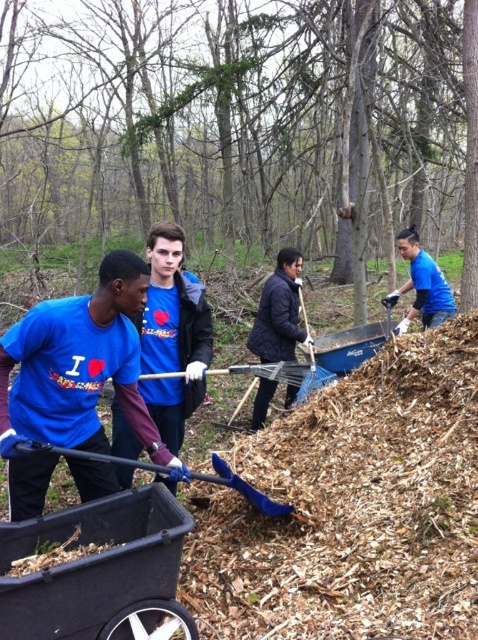
Which of these two, black plastic cart at lower left or blue plastic shovel at lower center, stands shorter?

blue plastic shovel at lower center is shorter.

Which is in front, point (143, 525) or point (267, 499)?

Point (143, 525)

Locate an element on the screen. The image size is (478, 640). black plastic cart at lower left is located at coordinates (97, 570).

In order to click on black plastic cart at lower left in this screenshot , I will do `click(97, 570)`.

Is dark blue quilted jacket at center to the right of blue matte shirt at upper right from the viewer's perspective?

In fact, dark blue quilted jacket at center is to the left of blue matte shirt at upper right.

Can you confirm if dark blue quilted jacket at center is positioned to the left of blue matte shirt at upper right?

Yes, dark blue quilted jacket at center is to the left of blue matte shirt at upper right.

Is point (280, 320) closer to viewer compared to point (455, 307)?

Yes, it is.

This screenshot has height=640, width=478. What are the coordinates of `dark blue quilted jacket at center` in the screenshot? It's located at (279, 310).

Can you confirm if black plastic cart at lower left is smaller than dark blue quilted jacket at center?

Correct, black plastic cart at lower left occupies less space than dark blue quilted jacket at center.

Consider the image. Measure the distance between point (158, 608) and camera.

Point (158, 608) and camera are 8.39 feet apart from each other.

I want to click on black plastic cart at lower left, so click(97, 570).